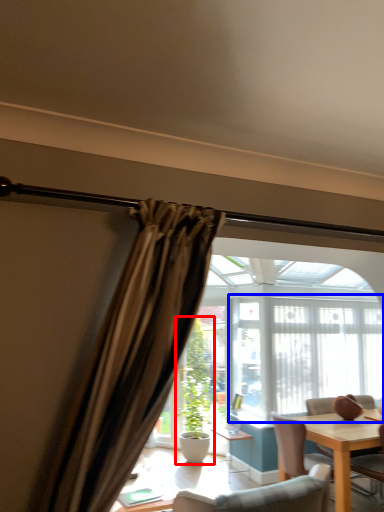
Question: Which object appears closest to the camera in this image, houseplant (highlighted by a red box) or window frame (highlighted by a blue box)?

Choices:
 (A) houseplant
 (B) window frame

Answer: (B)